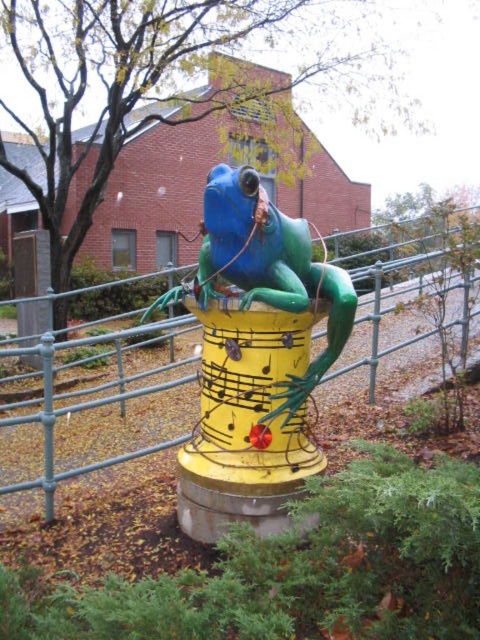
You are standing in the park and want to find the exact location of the point with coordinates [245,420]. According to the image, where should you look?

The point with coordinates [245,420] is located on the yellow painted metal at center.

You are a maintenance worker needing to repair both the yellow painted metal at center and the green metal fence at center. You have a ladder that is 5 feet long. Can you safely reach both objects without moving the ladder?

The distance between the yellow painted metal at center and the green metal fence at center is 4.59 feet, which is less than the ladder length of 5 feet. Therefore, you can safely move the ladder between them without needing to move it.

From the picture: You are a sculptor who wants to place a new decorative element between the yellow painted metal at center and the shiny blue frog at center. Given their sizes, which object should you place the element closer to to ensure it fits within the available space?

The yellow painted metal at center is narrower than the shiny blue frog at center, so placing the decorative element closer to the yellow painted metal at center would allow it to fit within the available space since it has a smaller width.